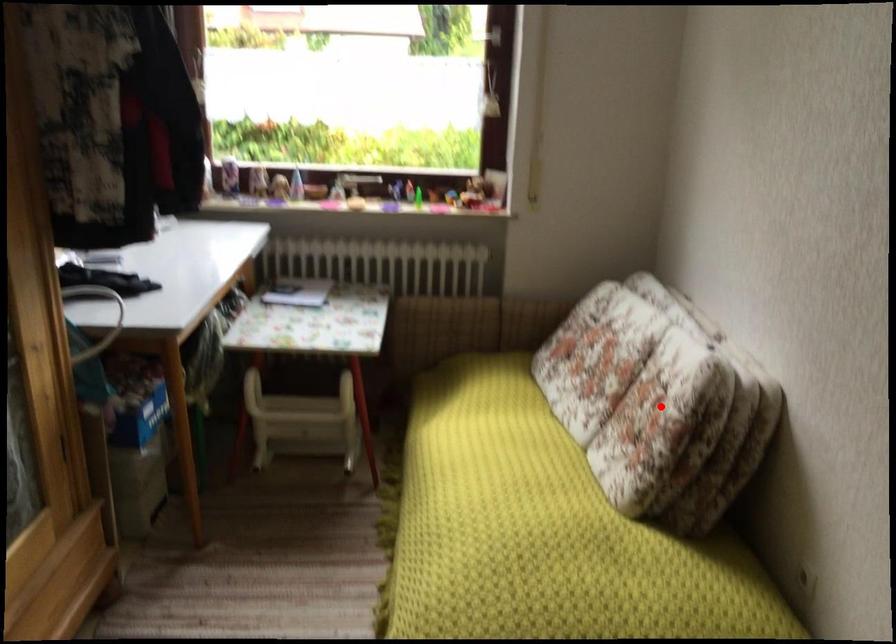
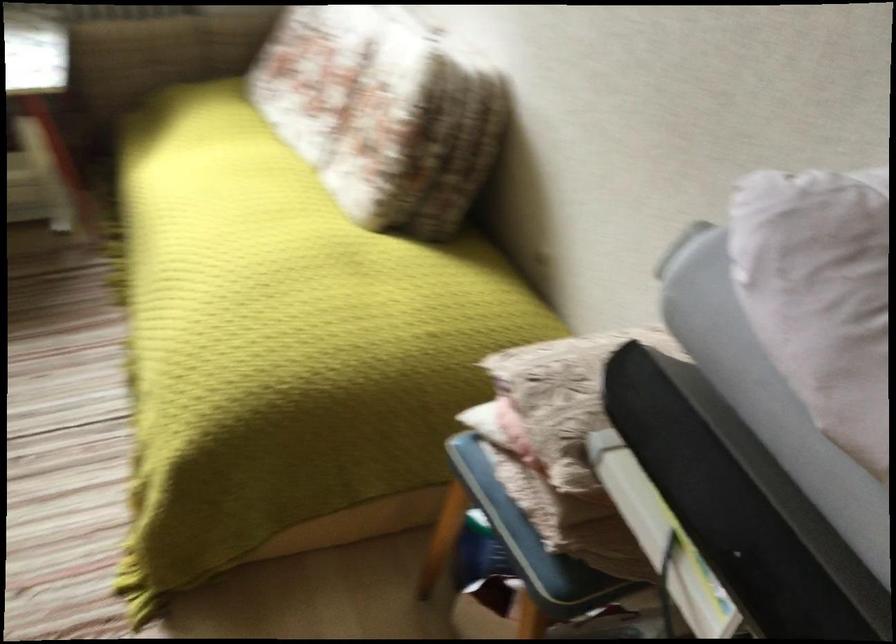
In the second image, find the point that corresponds to the highlighted location in the first image.

(382, 114)